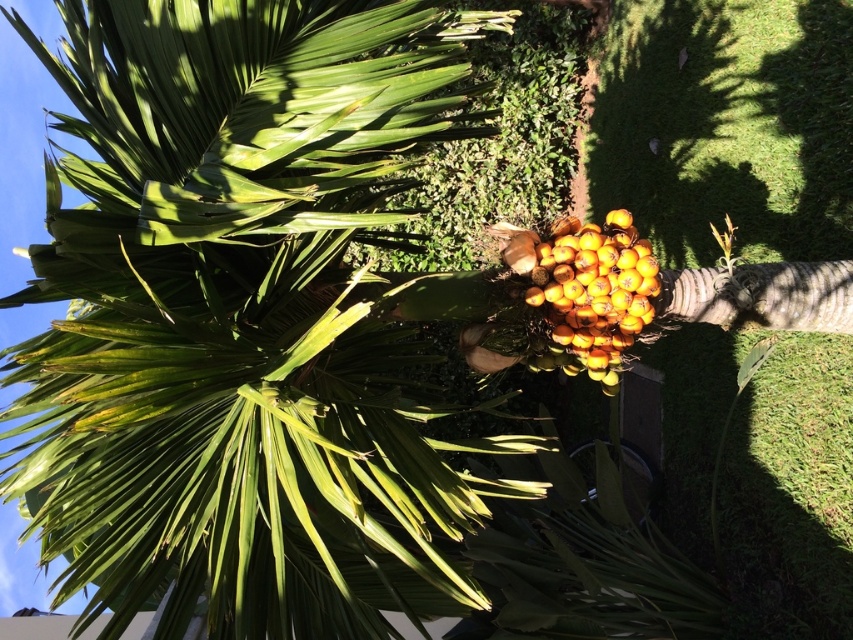
Question: Is the position of green leafy coconut tree at center less distant than that of yellow matte fruit at center?

Choices:
 (A) no
 (B) yes

Answer: (B)

Question: Does green leafy coconut tree at center appear on the left side of yellow matte fruit at center?

Choices:
 (A) no
 (B) yes

Answer: (B)

Question: Does green leafy coconut tree at center appear on the right side of yellow matte fruit at center?

Choices:
 (A) yes
 (B) no

Answer: (B)